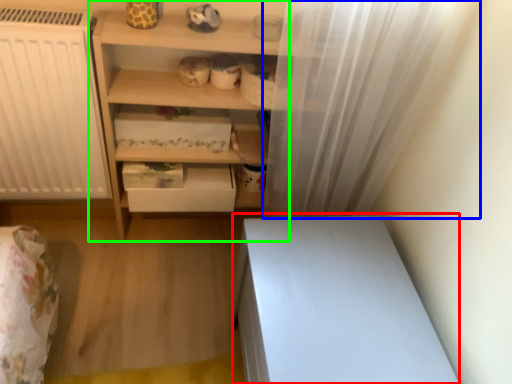
Question: Which is farther away from vanity (highlighted by a red box)? shower curtain (highlighted by a blue box) or shelf (highlighted by a green box)?

Choices:
 (A) shower curtain
 (B) shelf

Answer: (B)